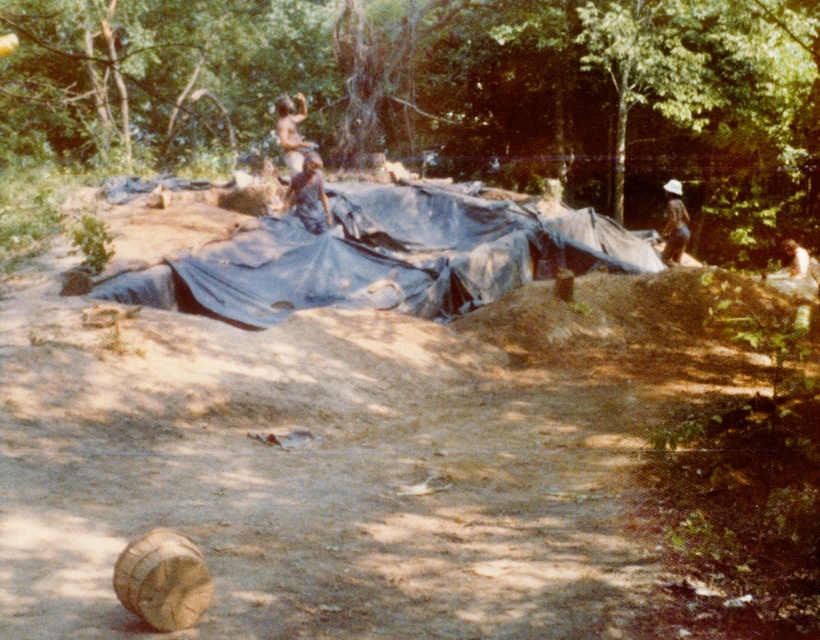
You are a hiker who wants to take a photo of the brown skin person at upper center and the brown fabric hat at upper right from your current position. Which object will appear closer to you in the photo?

The brown skin person at upper center will appear closer to you in the photo because they are positioned in front of the brown fabric hat at upper right.